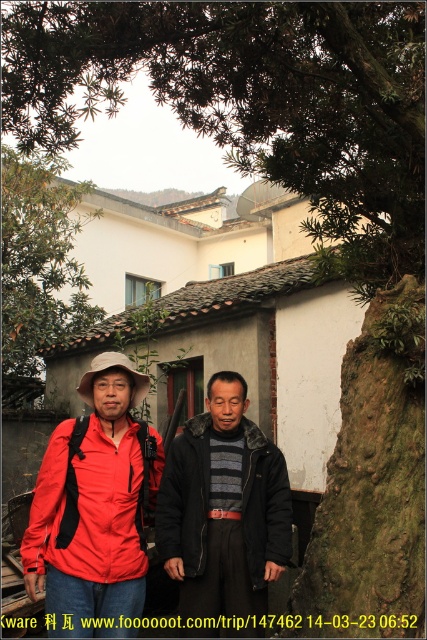
You are a photographer standing 5 meters away from the matte red jacket at left. You want to take a closeup shot of it. Can you move closer to get a better shot without exceeding the maximum distance of 3 meters from the jacket?

The matte red jacket at left is currently 3.55 meters away from the camera. Since you are standing 5 meters away, moving closer to 3 meters would require reducing the distance by 1.5 meters. However, the maximum allowed distance is 3 meters, so you can move closer to within 3 meters to take the closeup shot.

You are a photographer trying to capture both the matte red jacket at center and the matte red jacket at left in a single frame. Which jacket should you focus on first to ensure both are in the frame?

The matte red jacket at center is taller than the matte red jacket at left, so focusing on the taller one first will help ensure both are included in the frame.